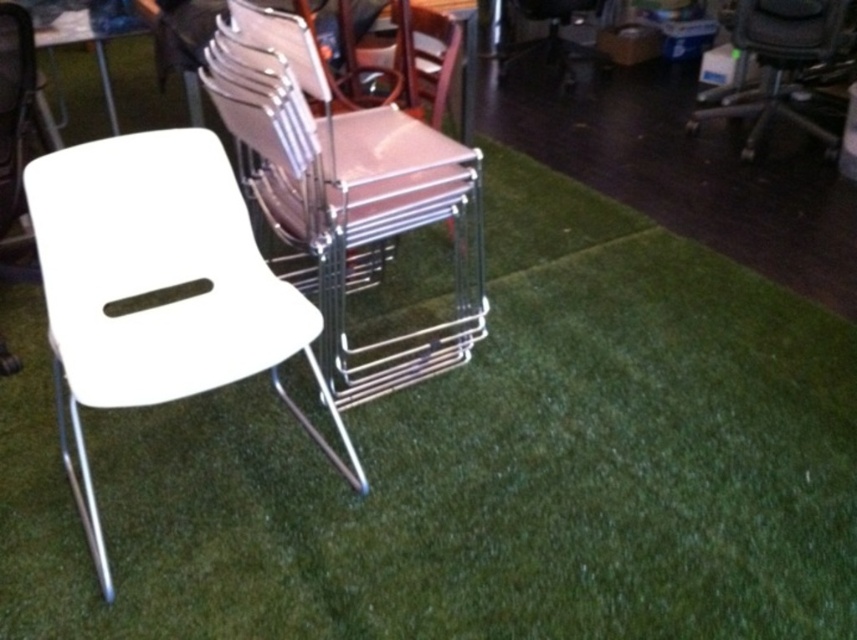
You are organizing a small indoor event and need to set up a table and chair. You have a white plastic table at upper left and a white plastic chair at center. Based on their positions, where should you place the chair relative to the table to maintain proper alignment?

The white plastic chair at center should be placed below the white plastic table at upper left to align them properly.

You are organizing chairs in a storage area and have two chairs to place next to each other. You have a white plastic chair at center and a white glossy chair at center. Given that the minimum required distance between chairs for easy access is 12 inches, will the current spacing between them allow for easy access?

The white plastic chair at center is 13.48 inches from the white glossy chair at center. Since 13.48 inches exceeds the minimum required distance of 12 inches, the current spacing allows for easy access.

You are a delivery person standing at the entrance of the storage area. You need to place a new chair that is 1.5 meters long in front of the white plastic chair at center without moving any other chairs. Is there enough space?

The distance between the white plastic chair at center and the camera is 1.29 meters. Since the new chair is 1.5 meters long, there isn not enough space to place it in front without moving other chairs.